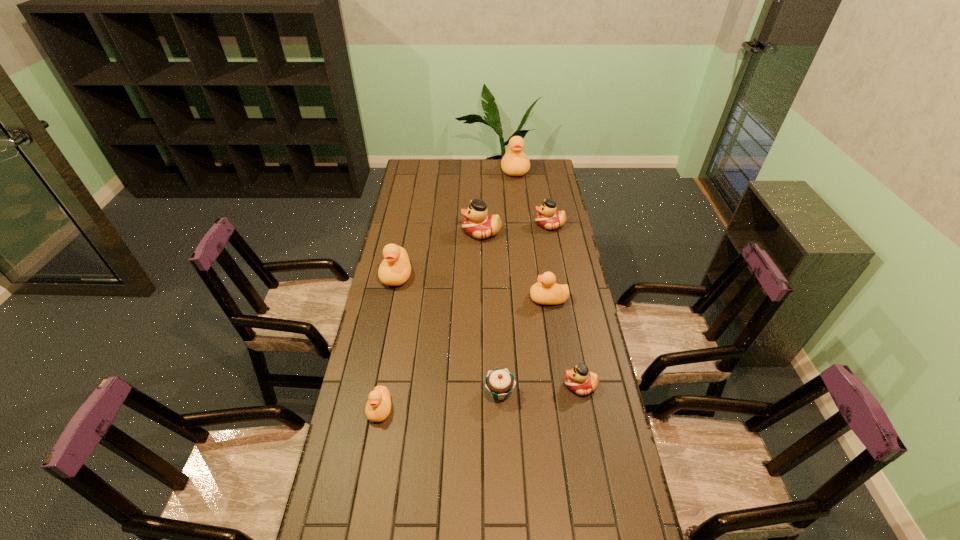
In the image, there is a desktop. What are the coordinates of `vacant region at the right edge` in the screenshot? It's located at (574, 248).

Where is `free region at the far left corner of the desktop`? The height and width of the screenshot is (540, 960). free region at the far left corner of the desktop is located at coordinates (420, 173).

Image resolution: width=960 pixels, height=540 pixels. What are the coordinates of `free spot between the smallest yellow duck and the cupcake` in the screenshot? It's located at (440, 401).

The height and width of the screenshot is (540, 960). What are the coordinates of `vacant area that lies between the nearest yellow duck and the second biggest yellow duck` in the screenshot? It's located at (388, 341).

Identify the location of free space between the cupcake and the second smallest yellow duck. (524, 346).

Find the location of `free space between the second smallest yellow duck and the third duck from left to right`. free space between the second smallest yellow duck and the third duck from left to right is located at coordinates (515, 265).

You are a GUI agent. You are given a task and a screenshot of the screen. Output one action in this format:
    pyautogui.click(x=<x>, y=<y>)
    Task: Click on the free space that is in between the biggest yellow duck and the third smallest yellow duck
    The width and height of the screenshot is (960, 540).
    Given the screenshot: What is the action you would take?
    pyautogui.click(x=456, y=222)

Locate an element on the screen. This screenshot has width=960, height=540. empty space between the biggest yellow duck and the nearest yellow duck is located at coordinates (447, 289).

Identify the location of free spot between the nearest red duck and the second biggest yellow duck. (489, 330).

Identify the location of vacant space that is in between the second smallest yellow duck and the farthest object. (532, 234).